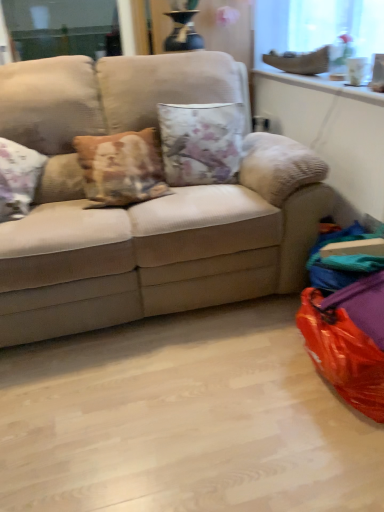
Locate an element on the screen. translucent glass window screen at upper right is located at coordinates [x=317, y=26].

Identify the location of beige fabric couch at center. (159, 245).

Where is `floral fabric cushion at center`? floral fabric cushion at center is located at coordinates (201, 142).

What do you see at coordinates (348, 340) in the screenshot? Image resolution: width=384 pixels, height=512 pixels. I see `orange plastic bean bag chair at lower right` at bounding box center [348, 340].

At what (x,y) coordinates should I click in order to perform the action: click on translucent glass window screen at upper right. Please return your answer as a coordinate pair (x, y). Looking at the image, I should click on (317, 26).

Does beige fabric couch at center turn towards orange plastic bean bag chair at lower right?

Yes, beige fabric couch at center is facing orange plastic bean bag chair at lower right.

Could orange plastic bean bag chair at lower right be considered to be inside beige fabric couch at center?

That's incorrect, orange plastic bean bag chair at lower right is not inside beige fabric couch at center.

Which object is further away from the camera taking this photo, beige fabric couch at center or orange plastic bean bag chair at lower right?

beige fabric couch at center.

What's the angular difference between beige fabric couch at center and orange plastic bean bag chair at lower right's facing directions?

beige fabric couch at center and orange plastic bean bag chair at lower right are facing 87.5 degrees away from each other.

Looking at this image, which is farther from the camera, (366, 345) or (231, 70)?

The point (231, 70) is farther from the camera.

Is orange plastic bean bag chair at lower right far from beige fabric couch at center?

No.

Locate an element on the screen. The height and width of the screenshot is (512, 384). studio couch that appears behind the orange plastic bean bag chair at lower right is located at coordinates (159, 245).

Is point (282, 12) in front of point (356, 338)?

No, (282, 12) is behind (356, 338).

The image size is (384, 512). Find the location of `bean bag chair in front of the translucent glass window screen at upper right`. bean bag chair in front of the translucent glass window screen at upper right is located at coordinates (348, 340).

Does translucent glass window screen at upper right lie behind orange plastic bean bag chair at lower right?

Yes, translucent glass window screen at upper right is further from the camera.

Could you tell me if translucent glass window screen at upper right is turned towards orange plastic bean bag chair at lower right?

No, translucent glass window screen at upper right is not oriented towards orange plastic bean bag chair at lower right.

In the image, is floral fabric cushion at center on the left side or the right side of orange plastic bean bag chair at lower right?

Based on their positions, floral fabric cushion at center is located to the left of orange plastic bean bag chair at lower right.

Would you say orange plastic bean bag chair at lower right is part of floral fabric cushion at center's contents?

No, orange plastic bean bag chair at lower right is located outside of floral fabric cushion at center.

Can you confirm if floral fabric cushion at center is smaller than orange plastic bean bag chair at lower right?

Indeed, floral fabric cushion at center has a smaller size compared to orange plastic bean bag chair at lower right.

From a real-world perspective, between beige fabric couch at center and translucent glass window screen at upper right, who is vertically higher?

translucent glass window screen at upper right, from a real-world perspective.

The height and width of the screenshot is (512, 384). Identify the location of studio couch on the left of translucent glass window screen at upper right. (159, 245).

Which is more to the right, beige fabric couch at center or translucent glass window screen at upper right?

Positioned to the right is translucent glass window screen at upper right.

Is beige fabric couch at center oriented towards translucent glass window screen at upper right?

No, beige fabric couch at center is not turned towards translucent glass window screen at upper right.

Does translucent glass window screen at upper right come behind floral fabric cushion at center?

No, translucent glass window screen at upper right is closer to the viewer.

From a real-world perspective, is translucent glass window screen at upper right above or below floral fabric cushion at center?

translucent glass window screen at upper right is situated higher than floral fabric cushion at center in the real world.

Is translucent glass window screen at upper right oriented towards floral fabric cushion at center?

No, translucent glass window screen at upper right is not oriented towards floral fabric cushion at center.

Is beige fabric couch at center surrounded by floral fabric cushion at center?

No, floral fabric cushion at center does not contain beige fabric couch at center.

Between floral fabric cushion at center and beige fabric couch at center, which one is positioned in front?

Positioned in front is beige fabric couch at center.

Does floral fabric cushion at center have a greater height compared to beige fabric couch at center?

No.

From the image's perspective, which is above, floral fabric cushion at center or beige fabric couch at center?

floral fabric cushion at center appears higher in the image.

Find the location of `studio couch on the left of the orange plastic bean bag chair at lower right`. studio couch on the left of the orange plastic bean bag chair at lower right is located at coordinates (159, 245).

Where is `studio couch that appears above the orange plastic bean bag chair at lower right (from a real-world perspective)`? The height and width of the screenshot is (512, 384). studio couch that appears above the orange plastic bean bag chair at lower right (from a real-world perspective) is located at coordinates (159, 245).

When comparing their distances from beige fabric couch at center, does orange plastic bean bag chair at lower right or floral fabric cushion at center seem closer?

floral fabric cushion at center is positioned closer to the anchor beige fabric couch at center.

Estimate the real-world distances between objects in this image. Which object is closer to floral fabric cushion at center, orange plastic bean bag chair at lower right or beige fabric couch at center?

The object closer to floral fabric cushion at center is beige fabric couch at center.

Based on their spatial positions, is beige fabric couch at center or orange plastic bean bag chair at lower right closer to floral fabric cushion at center?

beige fabric couch at center.

From the image, which object appears to be farther from orange plastic bean bag chair at lower right, beige fabric couch at center or floral fabric cushion at center?

The object further to orange plastic bean bag chair at lower right is floral fabric cushion at center.

Based on their spatial positions, is orange plastic bean bag chair at lower right or translucent glass window screen at upper right further from beige fabric couch at center?

The object further to beige fabric couch at center is translucent glass window screen at upper right.

Based on their spatial positions, is floral fabric cushion at center or beige fabric couch at center closer to translucent glass window screen at upper right?

floral fabric cushion at center.

Considering their positions, is beige fabric couch at center positioned further to orange plastic bean bag chair at lower right than translucent glass window screen at upper right?

translucent glass window screen at upper right.

Considering their positions, is translucent glass window screen at upper right positioned closer to beige fabric couch at center than floral fabric cushion at center?

Based on the image, floral fabric cushion at center appears to be nearer to beige fabric couch at center.

Identify the location of studio couch that lies between translucent glass window screen at upper right and orange plastic bean bag chair at lower right from top to bottom. The height and width of the screenshot is (512, 384). [x=159, y=245].

What are the coordinates of `pillow between beige fabric couch at center and translucent glass window screen at upper right` in the screenshot? It's located at (201, 142).

Image resolution: width=384 pixels, height=512 pixels. What are the coordinates of `pillow between translucent glass window screen at upper right and orange plastic bean bag chair at lower right from top to bottom` in the screenshot? It's located at point(201,142).

Locate an element on the screen. This screenshot has width=384, height=512. pillow between beige fabric couch at center and orange plastic bean bag chair at lower right from left to right is located at coordinates (201, 142).